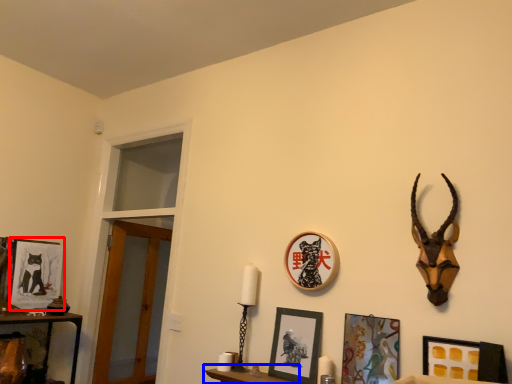
Question: Which object appears closest to the camera in this image, picture frame (highlighted by a red box) or furniture (highlighted by a blue box)?

Choices:
 (A) picture frame
 (B) furniture

Answer: (B)